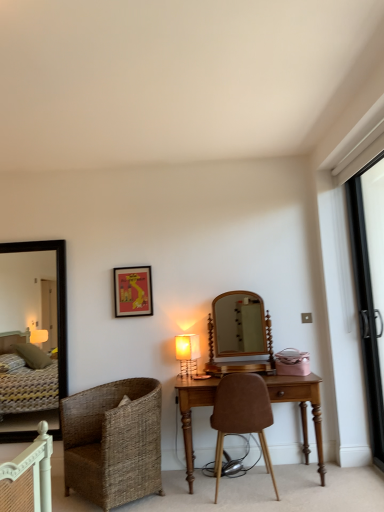
The height and width of the screenshot is (512, 384). Identify the location of black wooden mirror at left. (57, 298).

The width and height of the screenshot is (384, 512). What do you see at coordinates (241, 415) in the screenshot?
I see `brown leather chair at center, positioned as the first chair in right-to-left order` at bounding box center [241, 415].

What do you see at coordinates (301, 407) in the screenshot?
I see `wooden desk at center` at bounding box center [301, 407].

The width and height of the screenshot is (384, 512). What do you see at coordinates (369, 295) in the screenshot?
I see `clear glass screen door at right` at bounding box center [369, 295].

Image resolution: width=384 pixels, height=512 pixels. What are the coordinates of `woven brown chair at lower left, which is the second chair in right-to-left order` in the screenshot? It's located at (113, 442).

From the image's perspective, relative to matte red picture frame at upper center, is wooden desk at center above or below?

wooden desk at center is below matte red picture frame at upper center.

Would you say matte red picture frame at upper center is part of wooden desk at center's contents?

Definitely not — matte red picture frame at upper center is not inside wooden desk at center.

Can you confirm if wooden desk at center is positioned to the right of matte red picture frame at upper center?

Yes, wooden desk at center is to the right of matte red picture frame at upper center.

Consider the image. Which object is further away from the camera, wooden desk at center or matte red picture frame at upper center?

matte red picture frame at upper center is further from the camera.

Considering the positions of point (371, 320) and point (183, 361), is point (371, 320) closer or farther from the camera than point (183, 361)?

Point (371, 320) is positioned closer to the camera compared to point (183, 361).

From the image's perspective, is clear glass screen door at right positioned above or below metallic gold table lamp at center?

clear glass screen door at right is situated higher than metallic gold table lamp at center in the image.

Considering the sizes of clear glass screen door at right and metallic gold table lamp at center in the image, is clear glass screen door at right taller or shorter than metallic gold table lamp at center?

Clearly, clear glass screen door at right is taller compared to metallic gold table lamp at center.

Considering the sizes of clear glass screen door at right and metallic gold table lamp at center in the image, is clear glass screen door at right bigger or smaller than metallic gold table lamp at center?

In the image, clear glass screen door at right appears to be larger than metallic gold table lamp at center.

Considering the relative sizes of wooden desk at center and black wooden mirror at left in the image provided, is wooden desk at center smaller than black wooden mirror at left?

No.

From the image's perspective, between wooden desk at center and black wooden mirror at left, who is located below?

wooden desk at center appears lower in the image.

Who is taller, wooden desk at center or black wooden mirror at left?

black wooden mirror at left is taller.

Are wooden desk at center and black wooden mirror at left located far from each other?

Yes, wooden desk at center and black wooden mirror at left are located far from each other.

From the image's perspective, would you say matte red picture frame at upper center is positioned over wooden desk at center?

Indeed, from the image's perspective, matte red picture frame at upper center is shown above wooden desk at center.

Does matte red picture frame at upper center have a lesser width compared to wooden desk at center?

Indeed, matte red picture frame at upper center has a lesser width compared to wooden desk at center.

Is matte red picture frame at upper center closer to the viewer compared to wooden desk at center?

No, it is not.

Visually, is matte red picture frame at upper center positioned to the left or to the right of wooden desk at center?

Based on their positions, matte red picture frame at upper center is located to the left of wooden desk at center.

Is matte red picture frame at upper center oriented away from brown leather chair at center, positioned as the first chair in right-to-left order?

matte red picture frame at upper center does not have its back to brown leather chair at center, positioned as the first chair in right-to-left order.

Does matte red picture frame at upper center have a lesser width compared to brown leather chair at center, arranged as the second chair when viewed from the left?

Correct, the width of matte red picture frame at upper center is less than that of brown leather chair at center, arranged as the second chair when viewed from the left.

Is matte red picture frame at upper center to the right of brown leather chair at center, arranged as the second chair when viewed from the left, from the viewer's perspective?

No, matte red picture frame at upper center is not to the right of brown leather chair at center, arranged as the second chair when viewed from the left.

Between black wooden mirror at left and clear glass screen door at right, which one has smaller width?

With smaller width is black wooden mirror at left.

What's the angular difference between black wooden mirror at left and clear glass screen door at right's facing directions?

black wooden mirror at left and clear glass screen door at right are facing 89.5 degrees away from each other.

Which is behind, black wooden mirror at left or clear glass screen door at right?

Positioned behind is black wooden mirror at left.

Choose the correct answer: Is black wooden mirror at left inside clear glass screen door at right or outside it?

black wooden mirror at left is not inside clear glass screen door at right, it's outside.

From the image's perspective, which one is positioned lower, brown leather chair at center, arranged as the second chair when viewed from the left, or matte red picture frame at upper center?

brown leather chair at center, arranged as the second chair when viewed from the left.

What's the angular difference between brown leather chair at center, positioned as the first chair in right-to-left order, and matte red picture frame at upper center's facing directions?

The facing directions of brown leather chair at center, positioned as the first chair in right-to-left order, and matte red picture frame at upper center are 180 degrees apart.

Can you see brown leather chair at center, positioned as the first chair in right-to-left order, touching matte red picture frame at upper center?

No, brown leather chair at center, positioned as the first chair in right-to-left order, is not in contact with matte red picture frame at upper center.

From a real-world perspective, is brown leather chair at center, arranged as the second chair when viewed from the left, positioned above or below matte red picture frame at upper center?

Clearly, from a real-world perspective, brown leather chair at center, arranged as the second chair when viewed from the left, is below matte red picture frame at upper center.

Where is `picture frame that appears on the left of wooden desk at center`? This screenshot has height=512, width=384. picture frame that appears on the left of wooden desk at center is located at coordinates (133, 291).

This screenshot has height=512, width=384. In order to click on table lamp beneath the clear glass screen door at right (from a real-world perspective) in this screenshot , I will do `click(187, 353)`.

Based on their spatial positions, is woven brown chair at lower left, which is the second chair in right-to-left order, or brown leather chair at center, positioned as the first chair in right-to-left order, closer to matte red picture frame at upper center?

The object closer to matte red picture frame at upper center is woven brown chair at lower left, which is the second chair in right-to-left order.

From the picture: Which object lies nearer to the anchor point metallic gold table lamp at center, woven brown chair at lower left, which is the second chair in right-to-left order, or wooden desk at center?

woven brown chair at lower left, which is the second chair in right-to-left order, is positioned closer to the anchor metallic gold table lamp at center.

Which object lies nearer to the anchor point brown leather chair at center, positioned as the first chair in right-to-left order, woven brown chair at lower left, placed as the 1th chair when sorted from left to right, or clear glass screen door at right?

Based on the image, woven brown chair at lower left, placed as the 1th chair when sorted from left to right, appears to be nearer to brown leather chair at center, positioned as the first chair in right-to-left order.

Based on their spatial positions, is matte red picture frame at upper center or clear glass screen door at right further from metallic gold table lamp at center?

clear glass screen door at right is positioned further to the anchor metallic gold table lamp at center.

Looking at the image, which one is located closer to black wooden mirror at left, metallic gold table lamp at center or clear glass screen door at right?

Among the two, metallic gold table lamp at center is located nearer to black wooden mirror at left.

Based on the photo, from the image, which object appears to be nearer to brown leather chair at center, positioned as the first chair in right-to-left order, matte red picture frame at upper center or metallic gold table lamp at center?

metallic gold table lamp at center is positioned closer to the anchor brown leather chair at center, positioned as the first chair in right-to-left order.

Based on their spatial positions, is metallic gold table lamp at center or black wooden mirror at left further from woven brown chair at lower left, placed as the 1th chair when sorted from left to right?

The object further to woven brown chair at lower left, placed as the 1th chair when sorted from left to right, is black wooden mirror at left.

Consider the image. Considering their positions, is woven brown chair at lower left, which is the second chair in right-to-left order, positioned further to wooden desk at center than clear glass screen door at right?

Based on the image, woven brown chair at lower left, which is the second chair in right-to-left order, appears to be further to wooden desk at center.

Image resolution: width=384 pixels, height=512 pixels. Find the location of `chair between metallic gold table lamp at center and clear glass screen door at right in the horizontal direction`. chair between metallic gold table lamp at center and clear glass screen door at right in the horizontal direction is located at coordinates (241, 415).

You are a GUI agent. You are given a task and a screenshot of the screen. Output one action in this format:
    pyautogui.click(x=<x>, y=<y>)
    Task: Click on the mirror between woven brown chair at lower left, which is the second chair in right-to-left order, and matte red picture frame at upper center, along the z-axis
    
    Given the screenshot: What is the action you would take?
    pyautogui.click(x=57, y=298)

Locate an element on the screen. The image size is (384, 512). table lamp between woven brown chair at lower left, which is the second chair in right-to-left order, and brown leather chair at center, positioned as the first chair in right-to-left order, in the horizontal direction is located at coordinates (187, 353).

What are the coordinates of `table lamp located between matte red picture frame at upper center and clear glass screen door at right in the left-right direction` in the screenshot? It's located at (187, 353).